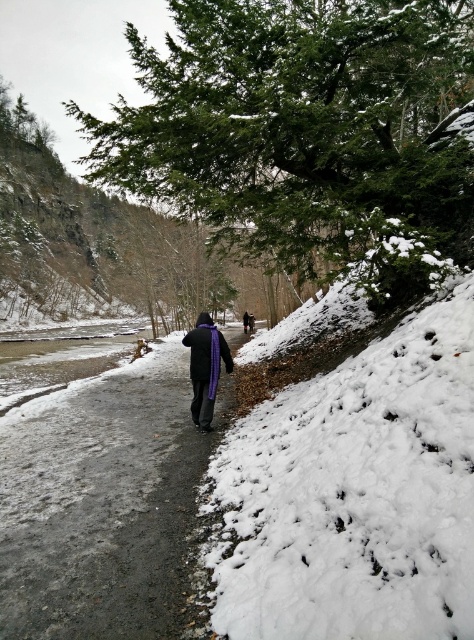
Question: Which of the following is the closest to the observer?

Choices:
 (A) white fluffy snow at right
 (B) purple fleece sweatshirt at center
 (C) gray gravel path at center

Answer: (A)

Question: Which of the following is the farthest from the observer?

Choices:
 (A) (129, 429)
 (B) (303, 512)

Answer: (A)

Question: Does green textured pine at upper center appear on the left side of gray gravel path at center?

Choices:
 (A) yes
 (B) no

Answer: (A)

Question: Is green textured pine at upper center bigger than gray gravel path at center?

Choices:
 (A) yes
 (B) no

Answer: (A)

Question: Is green textured pine at upper center to the right of purple fleece sweatshirt at center from the viewer's perspective?

Choices:
 (A) yes
 (B) no

Answer: (B)

Question: Which is farther from the gray gravel path at center?

Choices:
 (A) white fluffy snow at right
 (B) green textured pine at upper center

Answer: (B)